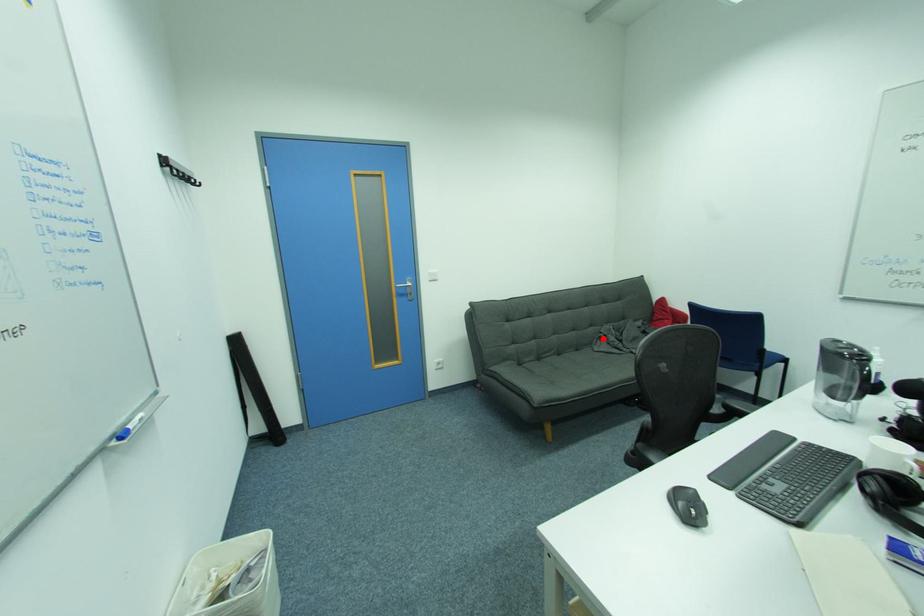
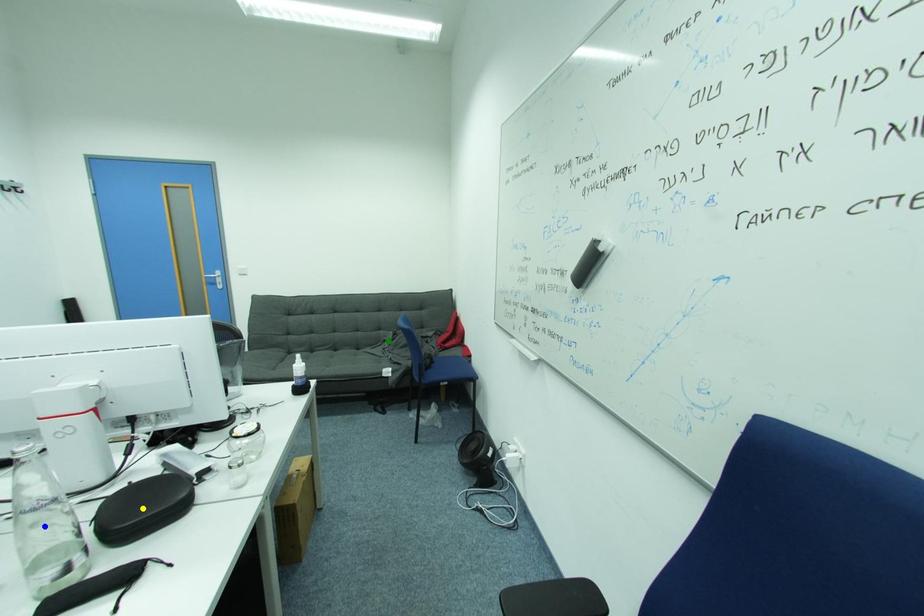
Question: I am providing you with two images of the same scene from different viewpoints. A red point is marked on the first image. You are given multiple points on the second image. Which point in image 2 is actually the same real-world point as the red point in image 1?

Choices:
 (A) green point
 (B) blue point
 (C) yellow point

Answer: (A)